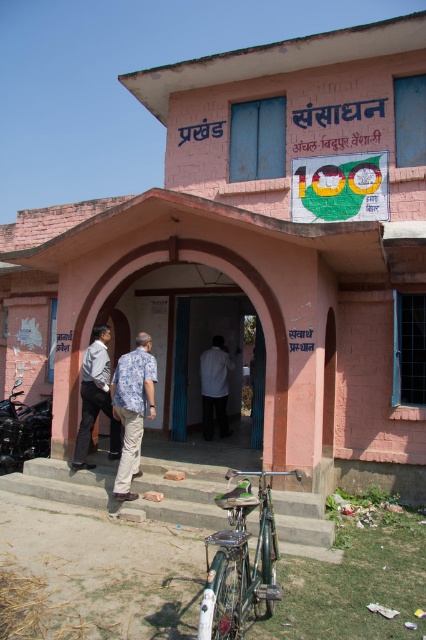
Between blue floral shirt at center and white fabric shirt at center, which one appears on the right side from the viewer's perspective?

white fabric shirt at center is more to the right.

Is point (124, 451) closer to camera compared to point (210, 385)?

Yes, point (124, 451) is in front of point (210, 385).

Where is `blue floral shirt at center`? The image size is (426, 640). blue floral shirt at center is located at coordinates (132, 408).

Which of these two, light blue shirt at center or white fabric shirt at center, stands shorter?

white fabric shirt at center is shorter.

Is light blue shirt at center taller than white fabric shirt at center?

Indeed, light blue shirt at center has a greater height compared to white fabric shirt at center.

Between point (88, 378) and point (210, 374), which one is positioned behind?

Point (210, 374)

You are a GUI agent. You are given a task and a screenshot of the screen. Output one action in this format:
    pyautogui.click(x=<x>, y=<y>)
    Task: Click on the light blue shirt at center
    The width and height of the screenshot is (426, 640).
    Given the screenshot: What is the action you would take?
    pyautogui.click(x=95, y=397)

Is blue floral shirt at center smaller than light blue shirt at center?

Actually, blue floral shirt at center might be larger than light blue shirt at center.

Can you confirm if blue floral shirt at center is shorter than light blue shirt at center?

Incorrect, blue floral shirt at center's height does not fall short of light blue shirt at center's.

I want to click on blue floral shirt at center, so click(x=132, y=408).

You are a GUI agent. You are given a task and a screenshot of the screen. Output one action in this format:
    pyautogui.click(x=<x>, y=<y>)
    Task: Click on the blue floral shirt at center
    Image resolution: width=426 pixels, height=640 pixels.
    Given the screenshot: What is the action you would take?
    pyautogui.click(x=132, y=408)